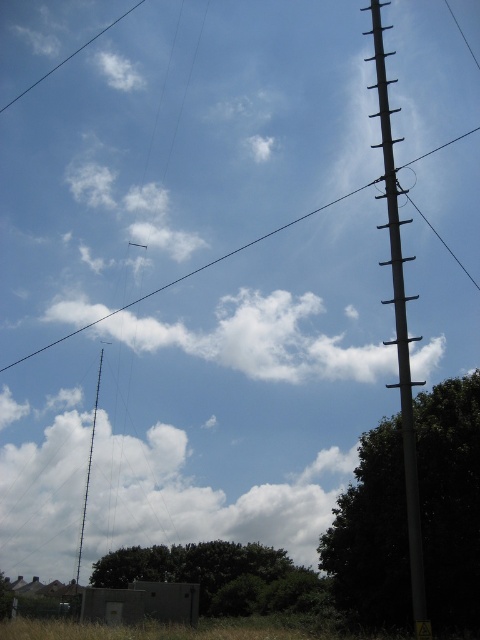
Question: Which point is farther from the camera taking this photo?

Choices:
 (A) (364, 605)
 (B) (80, 51)
 (C) (217, 561)

Answer: (B)

Question: Which object appears closest to the camera in this image?

Choices:
 (A) green leafy tree at lower center
 (B) white wire at upper left

Answer: (A)

Question: Does green leafy tree at right have a larger size compared to smooth gray pole at right?

Choices:
 (A) yes
 (B) no

Answer: (B)

Question: Is the position of green leafy tree at right more distant than that of green leafy tree at lower center?

Choices:
 (A) no
 (B) yes

Answer: (A)

Question: Which point is farther to the camera?

Choices:
 (A) (211, 564)
 (B) (370, 618)
 (C) (398, 225)

Answer: (A)

Question: Does green leafy tree at right appear on the right side of green leafy tree at lower center?

Choices:
 (A) no
 (B) yes

Answer: (B)